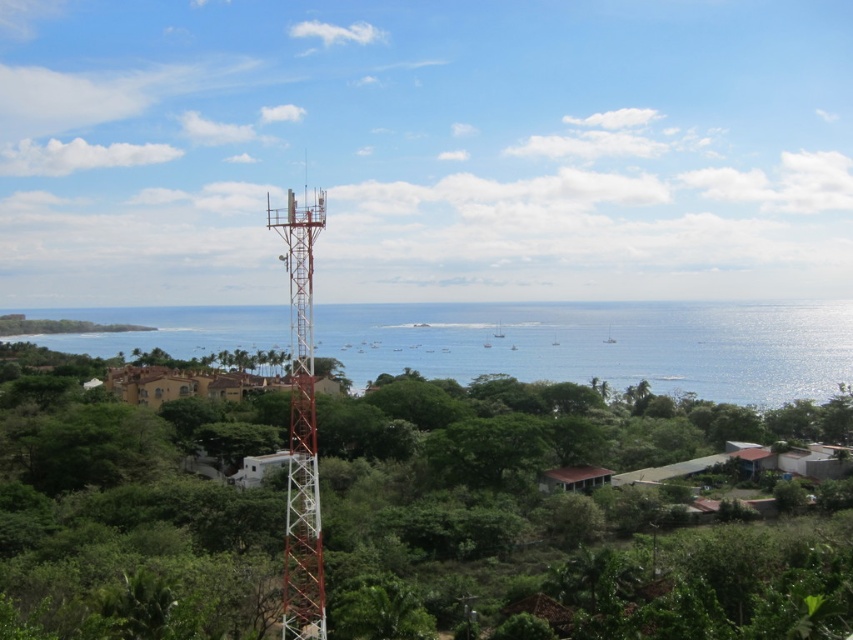
Looking at this image, you are a bird soaring above the coastal landscape. You see the blue water at center and the rustic metal tower at center. Which one is higher from your perspective?

The blue water at center is positioned over rustic metal tower at center, so from the bird perspective, the blue water at center appears higher.

Based on the provided image, what are the coordinates of the green leafy tree at center?

The green leafy tree at center is located at coordinates [555,513].